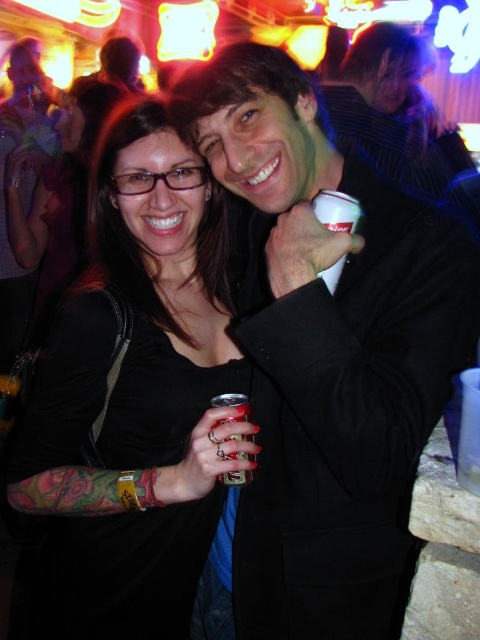
Can you confirm if matte black jacket at center is positioned to the left of metallic can at center?

No, matte black jacket at center is not to the left of metallic can at center.

Does matte black jacket at center have a greater width compared to metallic can at center?

Yes.

Who is more distant from viewer, (264, 196) or (233, 436)?

Point (264, 196)

Identify the location of matte black jacket at center. This screenshot has height=640, width=480. (324, 362).

Is matte black shirt at center positioned before white plastic cup at upper center?

That is False.

Does matte black shirt at center appear on the right side of white plastic cup at upper center?

No, matte black shirt at center is not to the right of white plastic cup at upper center.

Does point (160, 332) lie behind point (338, 211)?

Yes, point (160, 332) is behind point (338, 211).

The image size is (480, 640). Identify the location of matte black shirt at center. (132, 397).

What are the coordinates of `matte black shirt at center` in the screenshot? It's located at (132, 397).

Identify the location of matte black shirt at center. (132, 397).

Find the location of `matte black shirt at center`. matte black shirt at center is located at coordinates (132, 397).